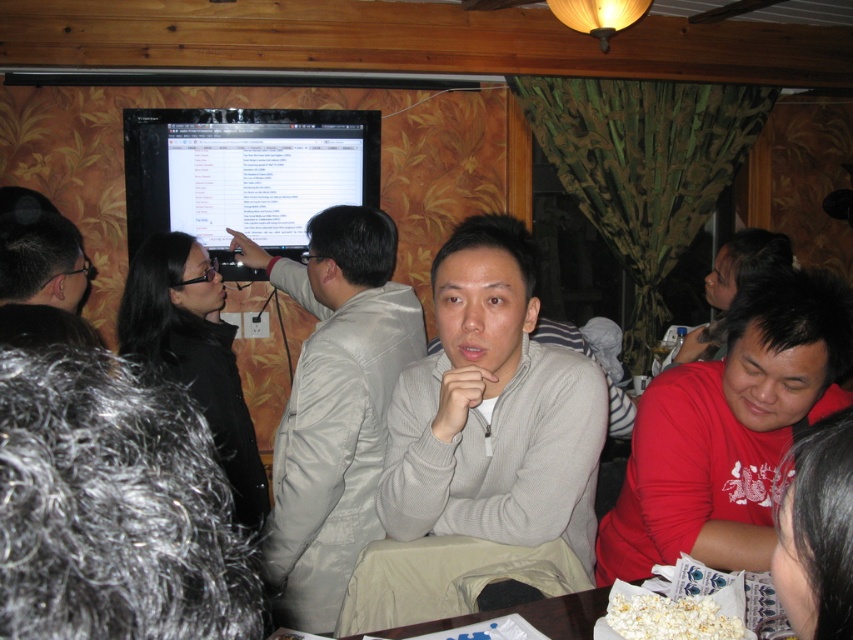
Is gray knit sweater at center to the right of white paper plate at lower center from the viewer's perspective?

No, gray knit sweater at center is not to the right of white paper plate at lower center.

Who is taller, gray knit sweater at center or white paper plate at lower center?

Standing taller between the two is gray knit sweater at center.

Who is more distant from viewer, (492, 266) or (567, 608)?

The point (492, 266) is more distant.

The width and height of the screenshot is (853, 640). In order to click on gray knit sweater at center in this screenshot , I will do `click(492, 410)`.

Is point (364, 128) farther from camera compared to point (758, 600)?

Yes, it is behind point (758, 600).

Between point (318, 129) and point (543, 612), which one is positioned behind?

Point (318, 129)

Image resolution: width=853 pixels, height=640 pixels. Identify the location of matte black monitor at upper left. (244, 173).

The height and width of the screenshot is (640, 853). Identify the location of matte black monitor at upper left. [244, 173].

Does gray knit sweater at center appear over matte black monitor at upper left?

No, gray knit sweater at center is not above matte black monitor at upper left.

Consider the image. Does gray knit sweater at center appear on the right side of matte black monitor at upper left?

Indeed, gray knit sweater at center is positioned on the right side of matte black monitor at upper left.

You are a GUI agent. You are given a task and a screenshot of the screen. Output one action in this format:
    pyautogui.click(x=<x>, y=<y>)
    Task: Click on the gray knit sweater at center
    The image size is (853, 640).
    Given the screenshot: What is the action you would take?
    pyautogui.click(x=492, y=410)